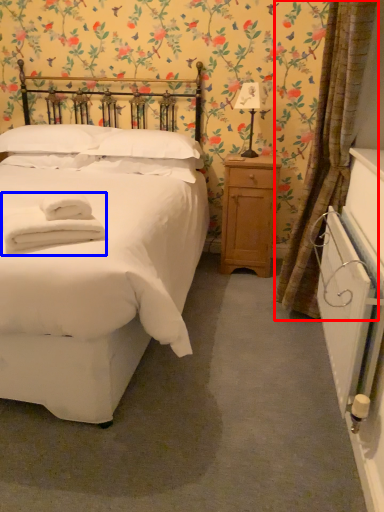
Question: Which object is further to the camera taking this photo, curtain (highlighted by a red box) or bath towel (highlighted by a blue box)?

Choices:
 (A) curtain
 (B) bath towel

Answer: (A)